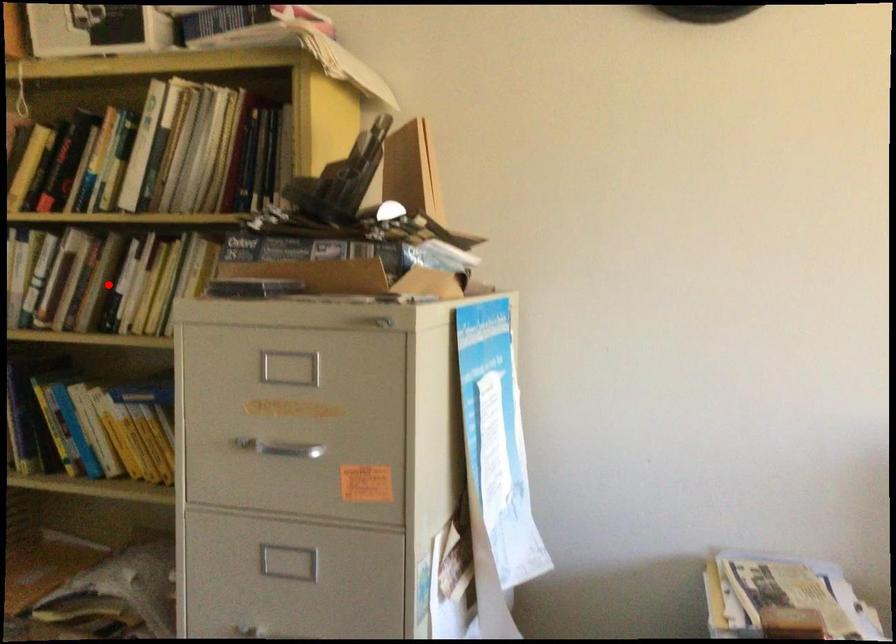
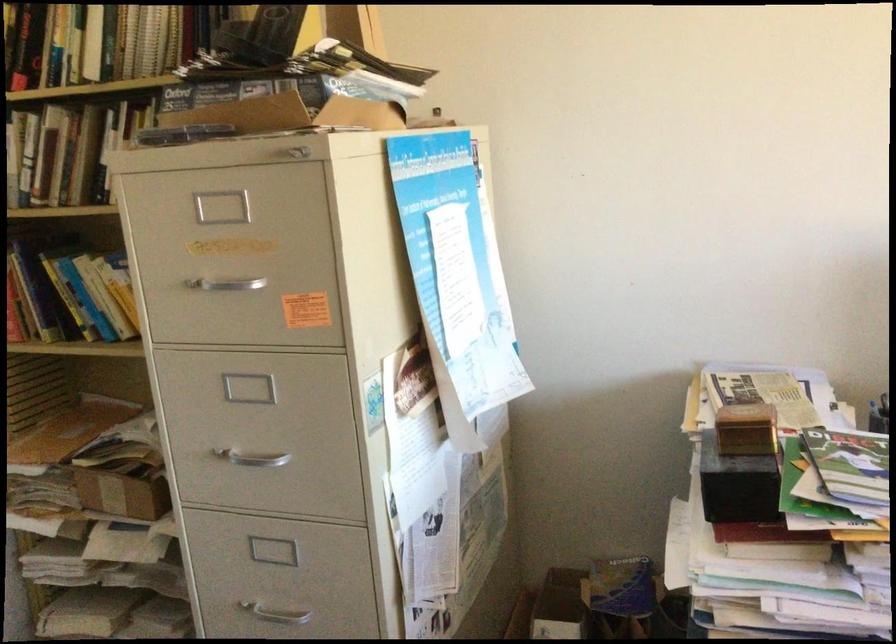
Where in the second image is the point corresponding to the highlighted location from the first image?

(83, 156)